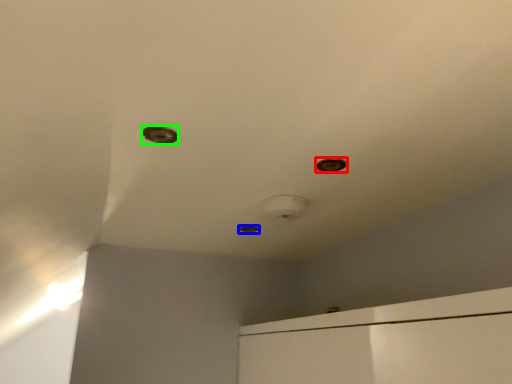
Question: Which is farther away from hole (highlighted by a red box)? hole (highlighted by a blue box) or hole (highlighted by a green box)?

Choices:
 (A) hole
 (B) hole

Answer: (A)